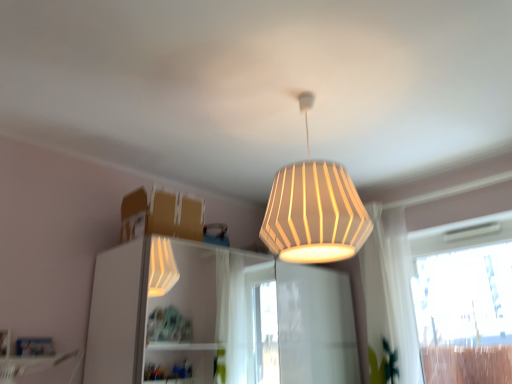
Question: Relative to white ribbed lampshade at upper center, is white sheer curtain at right in front or behind?

Choices:
 (A) behind
 (B) front

Answer: (A)

Question: Is white sheer curtain at right taller or shorter than white ribbed lampshade at upper center?

Choices:
 (A) short
 (B) tall

Answer: (B)

Question: Based on their relative distances, which object is nearer to the white sheer curtain at right?

Choices:
 (A) transparent glass window at right
 (B) white ribbed lampshade at upper center
 (C) white glossy dresser at center

Answer: (A)

Question: Estimate the real-world distances between objects in this image. Which object is closer to the white glossy dresser at center?

Choices:
 (A) white ribbed lampshade at upper center
 (B) white sheer curtain at right
 (C) transparent glass window at right

Answer: (B)